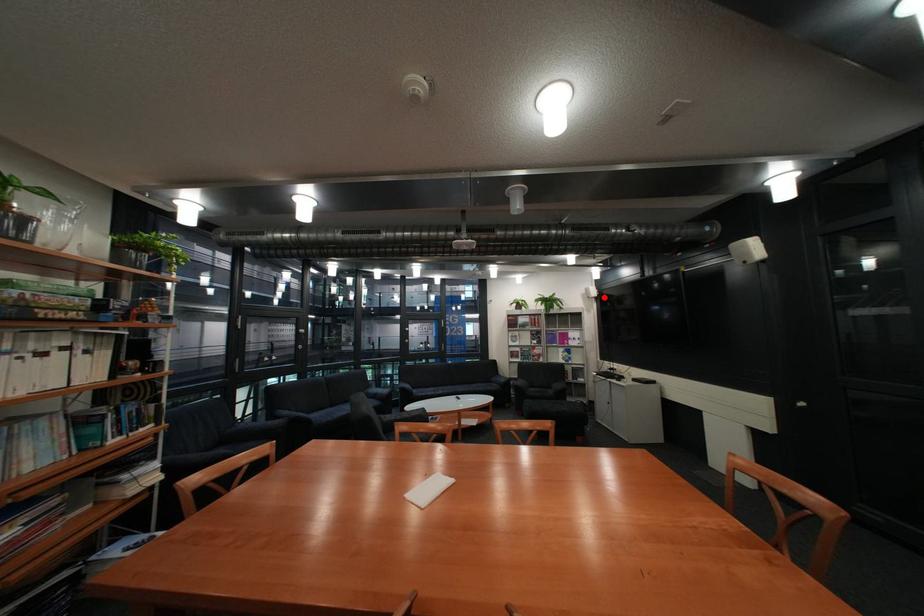
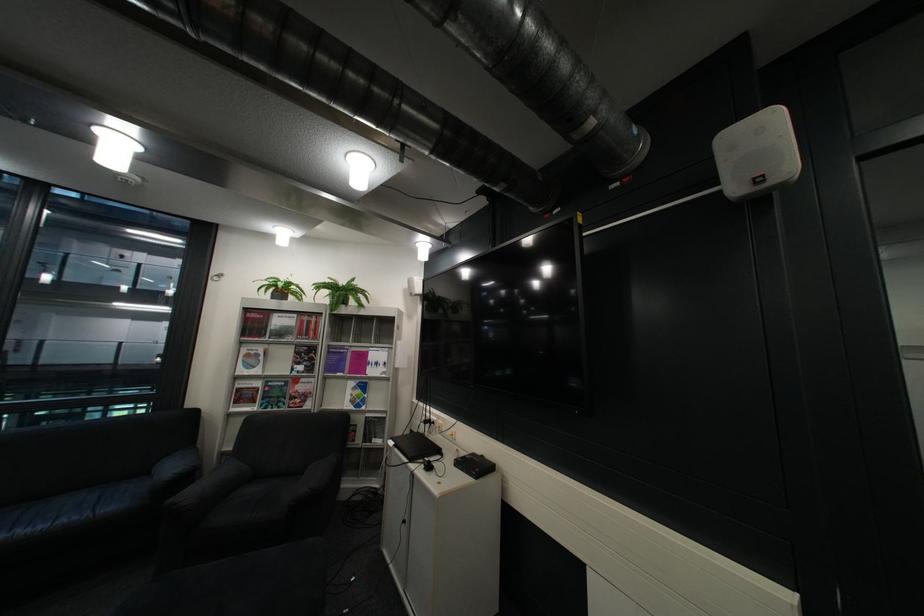
In the second image, find the point that corresponds to the highlighted location in the first image.

(427, 294)